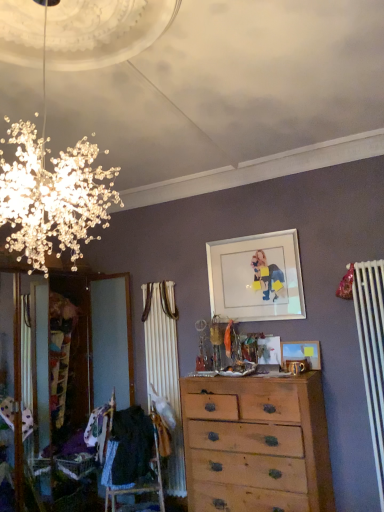
Question: From a real-world perspective, is wooden picture frame at center, the 1th picture frame ordered from the bottom, positioned above or below light brown wooden chest of drawers at center?

Choices:
 (A) below
 (B) above

Answer: (B)

Question: From the image's perspective, relative to light brown wooden chest of drawers at center, is wooden picture frame at center, the 1th picture frame ordered from the bottom, above or below?

Choices:
 (A) below
 (B) above

Answer: (B)

Question: Estimate the real-world distances between objects in this image. Which object is closer to the wooden picture frame at center, the 1th picture frame ordered from the bottom?

Choices:
 (A) white glossy picture frame at upper center, the 1th picture frame from the top
 (B) black fabric at lower left
 (C) light brown wooden chest of drawers at center

Answer: (A)

Question: Based on their relative distances, which object is nearer to the black fabric at lower left?

Choices:
 (A) white glossy picture frame at upper center, the second picture frame in the bottom-to-top sequence
 (B) wooden picture frame at center, the 1th picture frame ordered from the bottom
 (C) light brown wooden chest of drawers at center

Answer: (C)